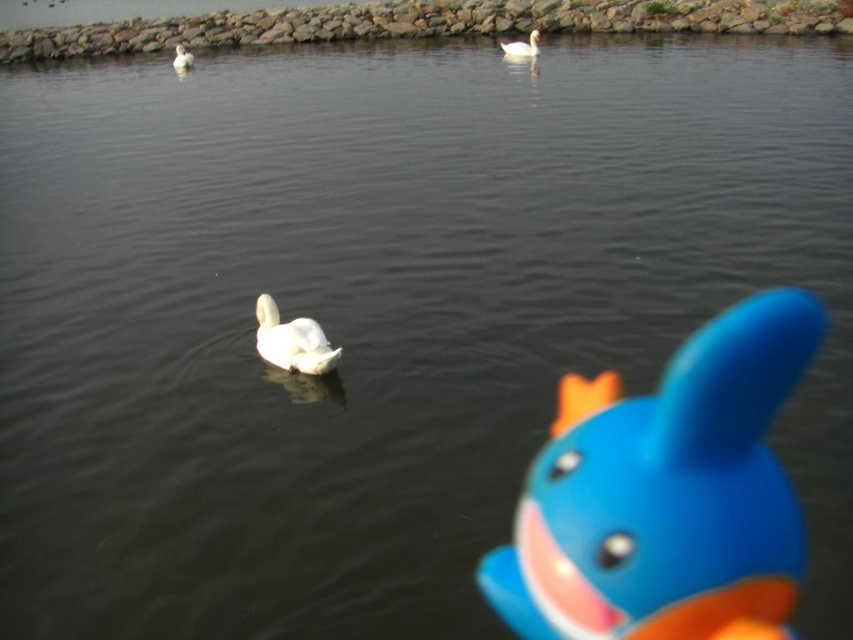
Question: Does blue rubber duck at right lie behind white matte swan at upper center?

Choices:
 (A) yes
 (B) no

Answer: (B)

Question: Based on their relative distances, which object is nearer to the blue rubber duck at center?

Choices:
 (A) white matte swan at upper center
 (B) blue rubber duck at right
 (C) white matte swan at center

Answer: (A)

Question: Can you confirm if blue rubber duck at right is positioned to the right of white matte swan at center?

Choices:
 (A) no
 (B) yes

Answer: (B)

Question: Which point appears farthest from the camera in this image?

Choices:
 (A) (524, 42)
 (B) (178, 61)
 (C) (726, 506)

Answer: (B)

Question: Estimate the real-world distances between objects in this image. Which object is closer to the white matte swan at center?

Choices:
 (A) blue rubber duck at right
 (B) white matte swan at upper center
 (C) blue rubber duck at center

Answer: (A)

Question: Is blue rubber duck at right wider than white matte swan at upper center?

Choices:
 (A) yes
 (B) no

Answer: (B)